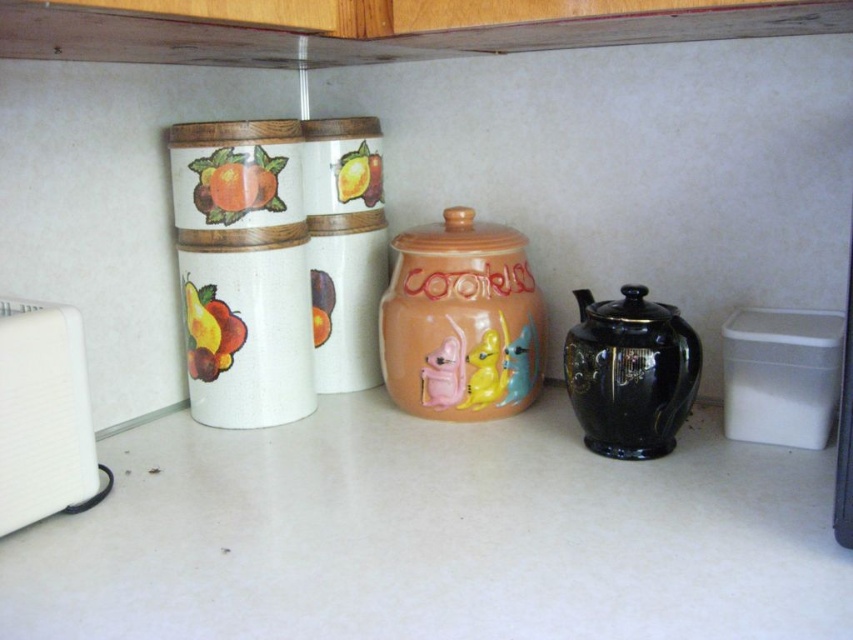
Is white plastic toaster at left wider than black glossy teapot at right?

Incorrect, white plastic toaster at left's width does not surpass black glossy teapot at right's.

Does white plastic toaster at left have a lesser height compared to black glossy teapot at right?

In fact, white plastic toaster at left may be taller than black glossy teapot at right.

Does point (70, 401) lie in front of point (650, 424)?

Yes.

The height and width of the screenshot is (640, 853). In order to click on white plastic toaster at left in this screenshot , I will do `click(42, 413)`.

Is white matte counter top at center taller than white plastic toaster at left?

No, white matte counter top at center is not taller than white plastic toaster at left.

Does white matte counter top at center have a lesser width compared to white plastic toaster at left?

No.

I want to click on white matte counter top at center, so click(x=434, y=536).

Can you confirm if white matte counter top at center is positioned below black glossy teapot at right?

Correct, white matte counter top at center is located below black glossy teapot at right.

Which is in front, point (782, 589) or point (666, 451)?

Point (782, 589) is more forward.

Find the location of `white matte counter top at center`. white matte counter top at center is located at coordinates coord(434,536).